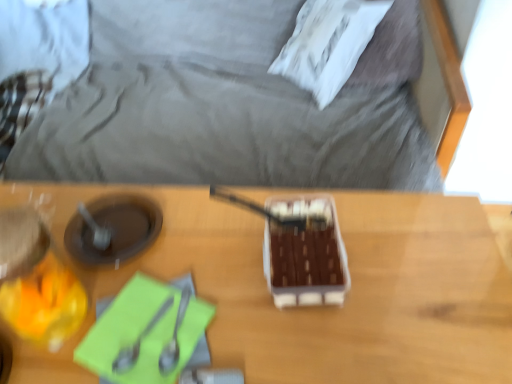
Locate an element on the screen. The image size is (512, 384). vacant space situated on the left part of brown matte chocolate bar at center is located at coordinates (217, 245).